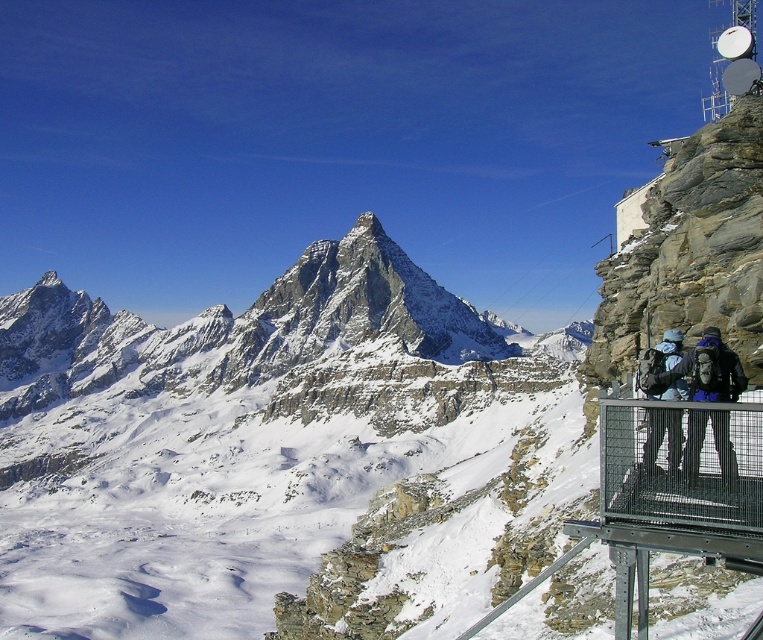
Based on the photo, you are a hiker planning to climb the mountain in the image. You have two backpacks available, the dark gray backpack at right and the dark blue fabric backpack at right. Which backpack should you choose if you want to carry more gear?

The dark blue fabric backpack at right should be chosen because it occupies more space than the dark gray backpack at right, allowing for more gear storage.

You are a hiker trying to place your backpack on the observation platform at the right side of the image. There is limited space between the dark gray backpack at right and the dark blue fabric backpack at right. If your backpack requires 5 feet of space, can you fit it between them?

The distance between the dark gray backpack at right and the dark blue fabric backpack at right is 4.63 feet, which is less than the required 5 feet. Therefore, you cannot fit your backpack between them.

You are a hiker standing at the observation platform with a dark gray backpack at right. You want to take a photo of the Matterhorn peak in the background. Since your camera has a maximum focus range of 140 feet, will you be able to capture the peak clearly?

The dark gray backpack at right is 140.99 feet away from the camera. Since the camera can only focus up to 140 feet, the backpack is slightly beyond the maximum range, so the Matterhorn peak might not be in focus and the photo may be blurry.